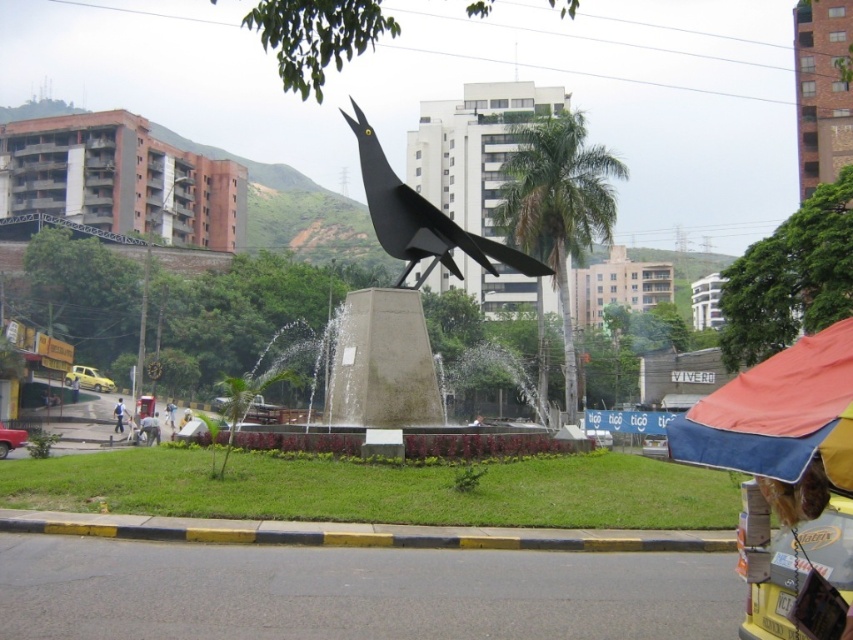
Question: Which of the following is the farthest from the observer?

Choices:
 (A) (799, 472)
 (B) (167, 403)

Answer: (B)

Question: Which point appears closest to the camera in this image?

Choices:
 (A) (119, 428)
 (B) (397, 237)

Answer: (B)

Question: Can you confirm if black matte bird at center is bigger than light brown leather jacket at center?

Choices:
 (A) yes
 (B) no

Answer: (A)

Question: Does light blue jeans at lower left have a larger size compared to light brown leather jacket at center?

Choices:
 (A) yes
 (B) no

Answer: (B)

Question: Based on their relative distances, which object is nearer to the black matte bird at center?

Choices:
 (A) light brown leather jacket at center
 (B) light blue jeans at lower left
 (C) orange fabric umbrella at lower right

Answer: (C)

Question: Can you confirm if black matte bird at center is positioned to the left of light brown leather jacket at center?

Choices:
 (A) yes
 (B) no

Answer: (B)